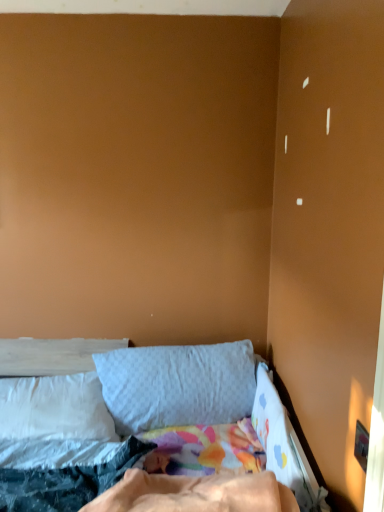
Question: Is soft cotton bed at lower left bigger than gray fabric pillow at center, arranged as the second pillow when viewed from the left?

Choices:
 (A) no
 (B) yes

Answer: (B)

Question: Does soft cotton bed at lower left lie in front of gray fabric pillow at center, arranged as the second pillow when viewed from the left?

Choices:
 (A) yes
 (B) no

Answer: (A)

Question: Is soft cotton bed at lower left to the left of gray fabric pillow at center, arranged as the second pillow when viewed from the left, from the viewer's perspective?

Choices:
 (A) yes
 (B) no

Answer: (B)

Question: Is soft cotton bed at lower left far from gray fabric pillow at center, acting as the first pillow starting from the right?

Choices:
 (A) yes
 (B) no

Answer: (B)

Question: Does soft cotton bed at lower left have a greater width compared to gray fabric pillow at center, acting as the first pillow starting from the right?

Choices:
 (A) yes
 (B) no

Answer: (A)

Question: Considering their positions, is white soft pillow at left, the 2th pillow when ordered from right to left, located in front of or behind gray fabric pillow at center, arranged as the second pillow when viewed from the left?

Choices:
 (A) front
 (B) behind

Answer: (A)

Question: Is white soft pillow at left, the 2th pillow when ordered from right to left, spatially inside gray fabric pillow at center, acting as the first pillow starting from the right, or outside of it?

Choices:
 (A) inside
 (B) outside

Answer: (B)

Question: Looking at the image, does white soft pillow at left, acting as the 1th pillow starting from the left, seem bigger or smaller compared to gray fabric pillow at center, acting as the first pillow starting from the right?

Choices:
 (A) small
 (B) big

Answer: (A)

Question: Considering the relative positions of white soft pillow at left, the 2th pillow when ordered from right to left, and gray fabric pillow at center, arranged as the second pillow when viewed from the left, in the image provided, is white soft pillow at left, the 2th pillow when ordered from right to left, to the left or to the right of gray fabric pillow at center, arranged as the second pillow when viewed from the left,?

Choices:
 (A) left
 (B) right

Answer: (A)

Question: From their relative heights in the image, would you say soft cotton bed at lower left is taller or shorter than gray fabric pillow at center, arranged as the second pillow when viewed from the left?

Choices:
 (A) tall
 (B) short

Answer: (B)

Question: In terms of size, does soft cotton bed at lower left appear bigger or smaller than gray fabric pillow at center, arranged as the second pillow when viewed from the left?

Choices:
 (A) small
 (B) big

Answer: (B)

Question: Is point (79, 364) positioned closer to the camera than point (180, 369)?

Choices:
 (A) closer
 (B) farther

Answer: (B)

Question: Considering the positions of soft cotton bed at lower left and gray fabric pillow at center, arranged as the second pillow when viewed from the left, in the image, is soft cotton bed at lower left wider or thinner than gray fabric pillow at center, arranged as the second pillow when viewed from the left,?

Choices:
 (A) wide
 (B) thin

Answer: (A)

Question: Is gray fabric pillow at center, acting as the first pillow starting from the right, situated inside soft cotton bed at lower left or outside?

Choices:
 (A) outside
 (B) inside

Answer: (A)

Question: From a real-world perspective, is gray fabric pillow at center, acting as the first pillow starting from the right, positioned above or below soft cotton bed at lower left?

Choices:
 (A) above
 (B) below

Answer: (B)